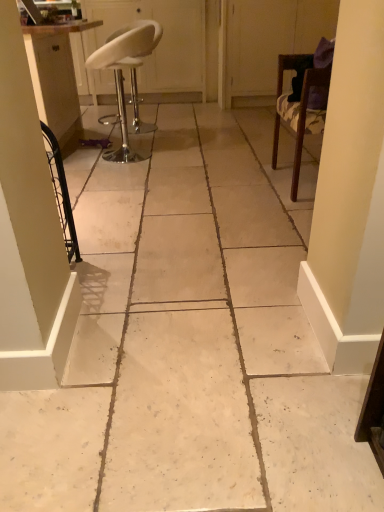
Question: From the image's perspective, is transparent plastic screen door at upper right, the 1th screen door positioned from the right, under white leather stool at upper left, the 1th screen door viewed from the left?

Choices:
 (A) no
 (B) yes

Answer: (B)

Question: Considering the relative sizes of transparent plastic screen door at upper right, which is the second screen door in left-to-right order, and white leather stool at upper left, the 2th screen door in the right-to-left sequence, in the image provided, is transparent plastic screen door at upper right, which is the second screen door in left-to-right order, smaller than white leather stool at upper left, the 2th screen door in the right-to-left sequence,?

Choices:
 (A) yes
 (B) no

Answer: (A)

Question: Is transparent plastic screen door at upper right, which is the second screen door in left-to-right order, facing towards white leather stool at upper left, the 2th screen door in the right-to-left sequence?

Choices:
 (A) no
 (B) yes

Answer: (A)

Question: Is transparent plastic screen door at upper right, the 1th screen door positioned from the right, at the left side of white leather stool at upper left, the 2th screen door in the right-to-left sequence?

Choices:
 (A) no
 (B) yes

Answer: (A)

Question: From the image's perspective, is transparent plastic screen door at upper right, which is the second screen door in left-to-right order, on white leather stool at upper left, the 1th screen door viewed from the left?

Choices:
 (A) no
 (B) yes

Answer: (A)

Question: Relative to white leather stool at upper left, the 1th screen door viewed from the left, is wooden chair at right, arranged as the 1th chair when viewed from the right, in front or behind?

Choices:
 (A) behind
 (B) front

Answer: (B)

Question: From a real-world perspective, is wooden chair at right, arranged as the 1th chair when viewed from the right, physically located above or below white leather stool at upper left, the 2th screen door in the right-to-left sequence?

Choices:
 (A) below
 (B) above

Answer: (A)

Question: From the image's perspective, is wooden chair at right, which is counted as the 2th chair, starting from the left, above or below white leather stool at upper left, the 1th screen door viewed from the left?

Choices:
 (A) above
 (B) below

Answer: (B)

Question: In terms of width, does wooden chair at right, arranged as the 1th chair when viewed from the right, look wider or thinner when compared to white leather stool at upper left, the 2th screen door in the right-to-left sequence?

Choices:
 (A) thin
 (B) wide

Answer: (A)

Question: Based on their sizes in the image, would you say white leather stool at upper left, acting as the 2th chair starting from the right, is bigger or smaller than matte white cabinet at left?

Choices:
 (A) small
 (B) big

Answer: (A)

Question: From their relative heights in the image, would you say white leather stool at upper left, placed as the 1th chair when sorted from left to right, is taller or shorter than matte white cabinet at left?

Choices:
 (A) short
 (B) tall

Answer: (A)

Question: From the image's perspective, relative to matte white cabinet at left, is white leather stool at upper left, acting as the 2th chair starting from the right, above or below?

Choices:
 (A) above
 (B) below

Answer: (B)

Question: Visually, is white leather stool at upper left, placed as the 1th chair when sorted from left to right, positioned to the left or to the right of matte white cabinet at left?

Choices:
 (A) right
 (B) left

Answer: (A)

Question: From the image's perspective, is white leather stool at upper left, the 2th screen door in the right-to-left sequence, located above or below wooden chair at right, which is counted as the 2th chair, starting from the left?

Choices:
 (A) below
 (B) above

Answer: (B)

Question: From a real-world perspective, is white leather stool at upper left, the 1th screen door viewed from the left, physically located above or below wooden chair at right, which is counted as the 2th chair, starting from the left?

Choices:
 (A) above
 (B) below

Answer: (A)